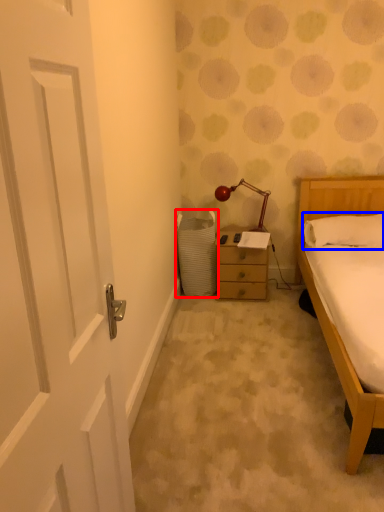
Question: Which point is further to the camera, laundry basket (highlighted by a red box) or pillow (highlighted by a blue box)?

Choices:
 (A) laundry basket
 (B) pillow

Answer: (A)